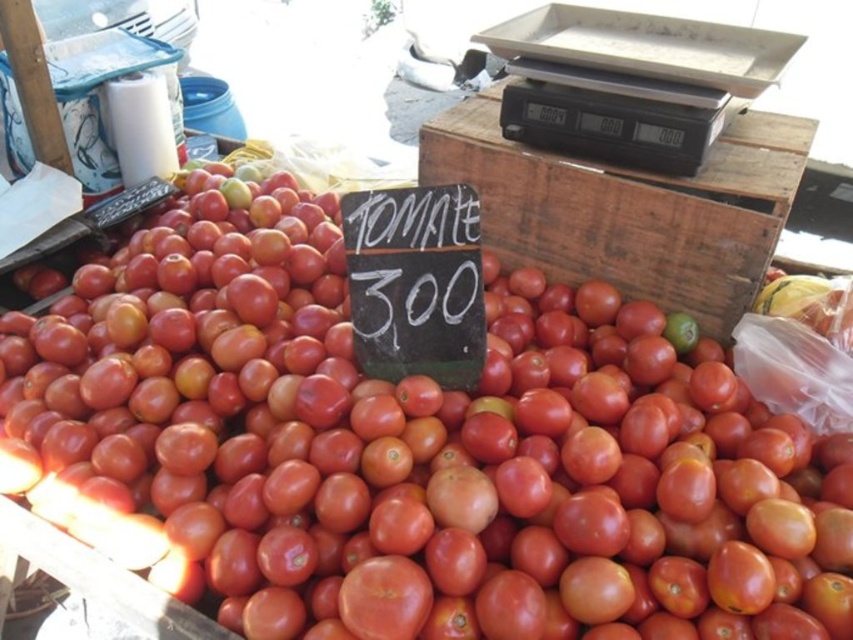
Question: Is shiny red tomato at center above wooden crate at center?

Choices:
 (A) no
 (B) yes

Answer: (A)

Question: Where is shiny red tomato at center located in relation to wooden crate at center in the image?

Choices:
 (A) left
 (B) right

Answer: (A)

Question: Which of the following is the closest to the observer?

Choices:
 (A) (463, 621)
 (B) (479, 131)

Answer: (A)

Question: Can you confirm if shiny red tomato at center is wider than wooden crate at center?

Choices:
 (A) no
 (B) yes

Answer: (B)